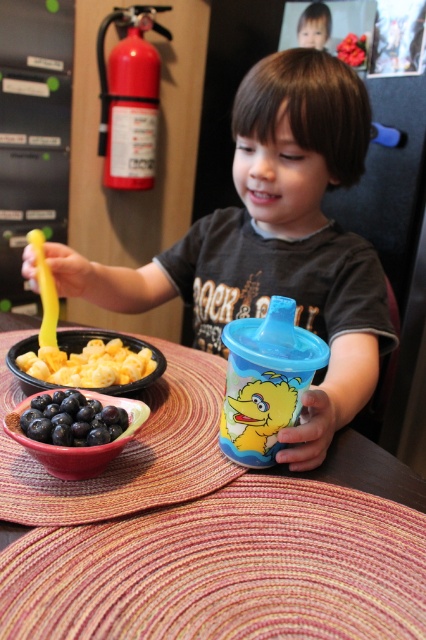
Question: Based on their relative distances, which object is farther from the blue matte/blueberry at lower left?

Choices:
 (A) matte pink bowl at lower left
 (B) wooden placemat at center

Answer: (B)

Question: Does yellow rubbery spoon at left appear over matte pink bowl at lower left?

Choices:
 (A) no
 (B) yes

Answer: (B)

Question: Can you confirm if yellow rubbery spoon at left is positioned below matte pink bowl at lower left?

Choices:
 (A) yes
 (B) no

Answer: (B)

Question: Which object is positioned farthest from the matte pink bowl at lower left?

Choices:
 (A) matte plastic cup at center
 (B) yellow rubbery spoon at left

Answer: (A)

Question: Which object appears closest to the camera in this image?

Choices:
 (A) yellow rubbery spoon at left
 (B) matte pink bowl at lower left

Answer: (B)

Question: Does blue matte/blueberry at lower left have a lesser width compared to matte pink bowl at lower left?

Choices:
 (A) yes
 (B) no

Answer: (A)